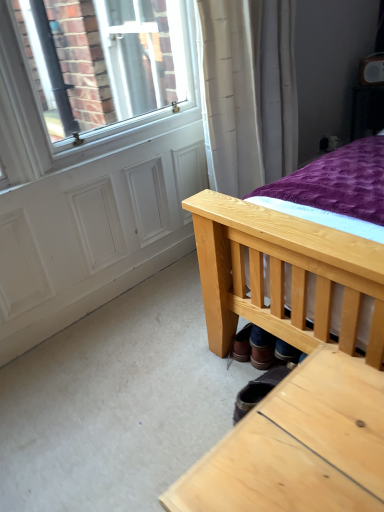
In order to click on brown leather shoe at lower center in this screenshot , I will do click(x=261, y=348).

What is the approximate height of white matte screen door at lower left?

It is 3.73 inches.

The width and height of the screenshot is (384, 512). Describe the element at coordinates (298, 446) in the screenshot. I see `light wood table at lower right` at that location.

Locate an element on the screen. light wood table at lower right is located at coordinates (298, 446).

This screenshot has height=512, width=384. Identify the location of brown leather shoe at lower center. (261, 348).

Based on the photo, from the image's perspective, is white matte screen door at lower left above or below brown leather shoe at lower center?

From the image's perspective, white matte screen door at lower left appears above brown leather shoe at lower center.

From the picture: Who is shorter, white matte screen door at lower left or brown leather shoe at lower center?

Standing shorter between the two is white matte screen door at lower left.

Considering the sizes of objects white matte screen door at lower left and brown leather shoe at lower center in the image provided, who is wider, white matte screen door at lower left or brown leather shoe at lower center?

With larger width is brown leather shoe at lower center.

Is white matte screen door at lower left oriented towards brown leather shoe at lower center?

Yes, white matte screen door at lower left is turned towards brown leather shoe at lower center.

Is point (180, 137) more distant than point (361, 419)?

That is True.

Who is smaller, white matte screen door at lower left or light wood table at lower right?

white matte screen door at lower left.

From a real-world perspective, between white matte screen door at lower left and light wood table at lower right, who is vertically lower?

In real-world perspective, white matte screen door at lower left is lower.

Considering the positions of objects brown leather shoe at lower center and leather boot at lower center in the image provided, who is more to the left, brown leather shoe at lower center or leather boot at lower center?

Positioned to the left is leather boot at lower center.

I want to click on footwear lying below the brown leather shoe at lower center (from the image's perspective), so click(257, 391).

Is brown leather shoe at lower center next to leather boot at lower center and touching it?

brown leather shoe at lower center is not next to leather boot at lower center, and they're not touching.

Is brown leather shoe at lower center oriented away from leather boot at lower center?

No, brown leather shoe at lower center is not facing the opposite direction of leather boot at lower center.

Which is correct: light wood table at lower right is inside brown leather shoe at lower center, or outside of it?

light wood table at lower right is not enclosed by brown leather shoe at lower center.

Can you confirm if light wood table at lower right is bigger than brown leather shoe at lower center?

Correct, light wood table at lower right is larger in size than brown leather shoe at lower center.

Between light wood table at lower right and brown leather shoe at lower center, which one is positioned in front?

light wood table at lower right is closer to the camera.

Looking at this image, considering the sizes of objects light wood table at lower right and brown leather shoe at lower center in the image provided, who is thinner, light wood table at lower right or brown leather shoe at lower center?

Thinner between the two is brown leather shoe at lower center.

Do you think light wood table at lower right is within white matte screen door at lower left, or outside of it?

light wood table at lower right is not inside white matte screen door at lower left, it's outside.

From the image's perspective, relative to white matte screen door at lower left, is light wood table at lower right above or below?

From the image's perspective, light wood table at lower right appears below white matte screen door at lower left.

Considering the relative sizes of leather boot at lower center and white matte screen door at lower left in the image provided, is leather boot at lower center shorter than white matte screen door at lower left?

Correct, leather boot at lower center is not as tall as white matte screen door at lower left.

Between point (272, 382) and point (43, 274), which one is positioned in front?

The point (272, 382) is in front.

Are leather boot at lower center and white matte screen door at lower left beside each other?

No.

In the scene shown: From the image's perspective, is leather boot at lower center below white matte screen door at lower left?

Correct, leather boot at lower center appears lower than white matte screen door at lower left in the image.

Considering the positions of point (234, 343) and point (277, 490), is point (234, 343) closer or farther from the camera than point (277, 490)?

Point (234, 343) appears to be farther away from the viewer than point (277, 490).

From a real-world perspective, which object rests below the other?

From a 3D spatial view, brown leather shoe at lower center is below.

Based on their positions, is brown leather shoe at lower center located to the left or right of light wood table at lower right?

Clearly, brown leather shoe at lower center is on the right of light wood table at lower right in the image.

At what (x,y) coordinates should I click in order to perform the action: click on screen door above the brown leather shoe at lower center (from a real-world perspective). Please return your answer as a coordinate pair (x, y). The height and width of the screenshot is (512, 384). Looking at the image, I should click on (95, 231).

You are a GUI agent. You are given a task and a screenshot of the screen. Output one action in this format:
    pyautogui.click(x=<x>, y=<y>)
    Task: Click on the table on the right of white matte screen door at lower left
    This screenshot has width=384, height=512.
    Given the screenshot: What is the action you would take?
    pyautogui.click(x=298, y=446)

Based on their spatial positions, is brown leather shoe at lower center or white matte screen door at lower left further from light wood table at lower right?

white matte screen door at lower left is positioned further to the anchor light wood table at lower right.

When comparing their distances from light wood table at lower right, does leather boot at lower center or brown leather shoe at lower center seem further?

Among the two, brown leather shoe at lower center is located further to light wood table at lower right.

From the image, which object appears to be nearer to leather boot at lower center, light wood table at lower right or white matte screen door at lower left?

Among the two, light wood table at lower right is located nearer to leather boot at lower center.

From the image, which object appears to be nearer to light wood table at lower right, leather boot at lower center or white matte screen door at lower left?

Based on the image, leather boot at lower center appears to be nearer to light wood table at lower right.

Based on their spatial positions, is light wood table at lower right or leather boot at lower center further from white matte screen door at lower left?

light wood table at lower right is further to white matte screen door at lower left.

Estimate the real-world distances between objects in this image. Which object is closer to brown leather shoe at lower center, leather boot at lower center or light wood table at lower right?

leather boot at lower center lies closer to brown leather shoe at lower center than the other object.

Considering their positions, is brown leather shoe at lower center positioned closer to white matte screen door at lower left than light wood table at lower right?

The object closer to white matte screen door at lower left is brown leather shoe at lower center.

Which object lies further to the anchor point white matte screen door at lower left, leather boot at lower center or brown leather shoe at lower center?

Among the two, leather boot at lower center is located further to white matte screen door at lower left.

Find the location of a particular element. Image resolution: width=384 pixels, height=512 pixels. footwear between light wood table at lower right and white matte screen door at lower left from front to back is located at coordinates (257, 391).

Where is `footwear between light wood table at lower right and brown leather shoe at lower center along the z-axis`? Image resolution: width=384 pixels, height=512 pixels. footwear between light wood table at lower right and brown leather shoe at lower center along the z-axis is located at coordinates (257, 391).

What are the coordinates of `footwear situated between white matte screen door at lower left and brown leather shoe at lower center from left to right` in the screenshot? It's located at (257, 391).

At what (x,y) coordinates should I click in order to perform the action: click on shoe between light wood table at lower right and white matte screen door at lower left in the front-back direction. Please return your answer as a coordinate pair (x, y). This screenshot has height=512, width=384. Looking at the image, I should click on (261, 348).